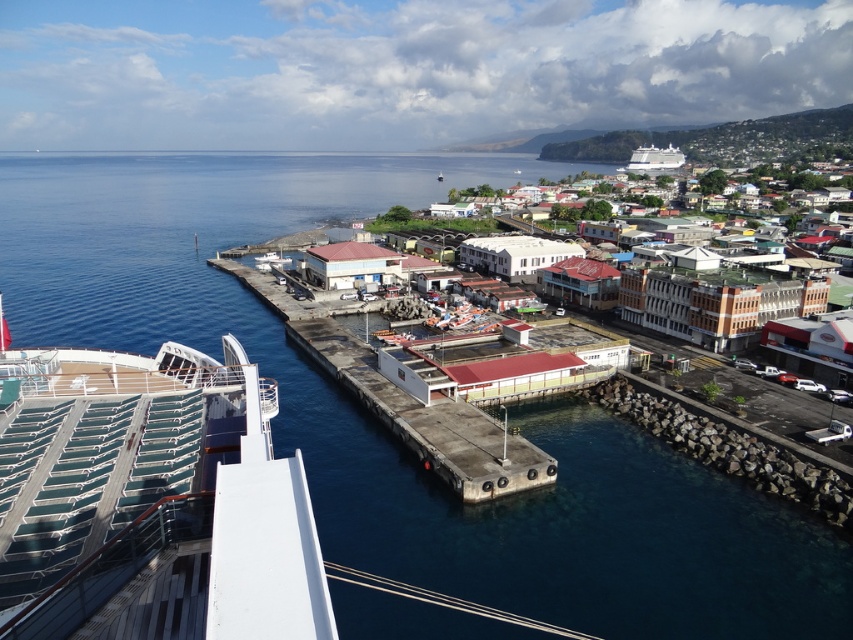
Question: Can you confirm if teal plastic deck at lower left is bigger than white glossy cruise ship at upper right?

Choices:
 (A) yes
 (B) no

Answer: (B)

Question: Which object is closer to the camera taking this photo?

Choices:
 (A) white glossy cruise ship at upper right
 (B) teal plastic deck at lower left
 (C) white concrete dock at center
 (D) white matte boat at center

Answer: (B)

Question: Among these objects, which one is farthest from the camera?

Choices:
 (A) teal plastic deck at lower left
 (B) white glossy cruise ship at upper right

Answer: (B)

Question: Which point is farther to the camera?

Choices:
 (A) white matte boat at center
 (B) white glossy cruise ship at upper right
 (C) white concrete dock at center

Answer: (B)

Question: Is white concrete dock at center thinner than white matte boat at center?

Choices:
 (A) yes
 (B) no

Answer: (B)

Question: Is teal plastic deck at lower left above white concrete dock at center?

Choices:
 (A) yes
 (B) no

Answer: (B)